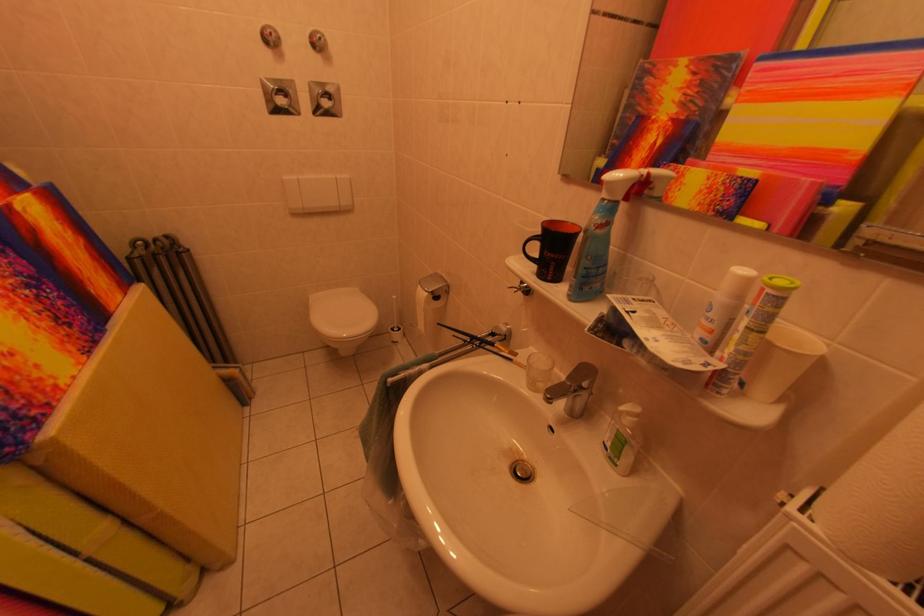
The height and width of the screenshot is (616, 924). I want to click on toilet brush handle, so click(x=395, y=323).